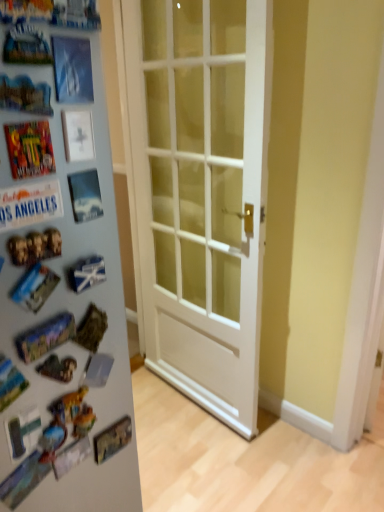
Describe the element at coordinates (200, 192) in the screenshot. I see `white glossy door at center` at that location.

Measure the distance between shiny metallic comic book at left and camera.

They are 58.01 centimeters apart.

This screenshot has width=384, height=512. Identify the location of white glossy refrigerator at left. (61, 278).

Image resolution: width=384 pixels, height=512 pixels. I want to click on white glossy door at center, so click(200, 192).

Is the surface of shiny metallic comic book at left in direct contact with white glossy refrigerator at left?

shiny metallic comic book at left and white glossy refrigerator at left are clearly separated.

In the image, is shiny metallic comic book at left positioned in front of or behind white glossy refrigerator at left?

Clearly, shiny metallic comic book at left is in front of white glossy refrigerator at left.

Consider the image. From a real-world perspective, is shiny metallic comic book at left over white glossy refrigerator at left?

Yes, from a real-world perspective, shiny metallic comic book at left is over white glossy refrigerator at left

Is point (30, 134) closer or farther from the camera than point (58, 399)?

Point (30, 134) is closer to the camera than point (58, 399).

Which point is more distant from viewer, (45, 156) or (266, 4)?

The point (266, 4) is more distant.

Is shiny metallic comic book at left directly adjacent to white glossy door at center?

No, shiny metallic comic book at left is not beside white glossy door at center.

From a real-world perspective, which is physically above, shiny metallic comic book at left or white glossy door at center?

In real-world perspective, shiny metallic comic book at left is above.

Is shiny metallic comic book at left positioned beyond the bounds of white glossy door at center?

Yes.

From the image's perspective, which is above, white glossy door at center or shiny metallic comic book at left?

From the image's view, shiny metallic comic book at left is above.

Is shiny metallic comic book at left surrounded by white glossy door at center?

That's incorrect, shiny metallic comic book at left is not inside white glossy door at center.

From the picture: From a real-world perspective, who is located lower, white glossy door at center or shiny metallic comic book at left?

From a 3D spatial view, white glossy door at center is below.

Locate an element on the screen. This screenshot has width=384, height=512. comic book above the white glossy door at center (from a real-world perspective) is located at coordinates (30, 149).

Does white glossy door at center come behind white glossy refrigerator at left?

Yes, white glossy door at center is further from the viewer.

Which of these two, white glossy door at center or white glossy refrigerator at left, stands shorter?

white glossy door at center.

Identify the location of door below the white glossy refrigerator at left (from a real-world perspective). (200, 192).

Between point (180, 21) and point (16, 262), which one is positioned behind?

The point (180, 21) is farther from the camera.

From a real-world perspective, between white glossy refrigerator at left and shiny metallic comic book at left, who is vertically higher?

shiny metallic comic book at left.

Based on the photo, is white glossy refrigerator at left to the right of shiny metallic comic book at left from the viewer's perspective?

No, white glossy refrigerator at left is not to the right of shiny metallic comic book at left.

From the image's perspective, would you say white glossy refrigerator at left is shown under shiny metallic comic book at left?

Correct, white glossy refrigerator at left appears lower than shiny metallic comic book at left in the image.

Can you confirm if white glossy refrigerator at left is shorter than shiny metallic comic book at left?

In fact, white glossy refrigerator at left may be taller than shiny metallic comic book at left.

Can you confirm if white glossy refrigerator at left is bigger than white glossy door at center?

Correct, white glossy refrigerator at left is larger in size than white glossy door at center.

Based on the photo, considering the relative sizes of white glossy refrigerator at left and white glossy door at center in the image provided, is white glossy refrigerator at left shorter than white glossy door at center?

In fact, white glossy refrigerator at left may be taller than white glossy door at center.

Can you see white glossy refrigerator at left touching white glossy door at center?

No, white glossy refrigerator at left is not in contact with white glossy door at center.

Is white glossy refrigerator at left positioned behind white glossy door at center?

No, white glossy refrigerator at left is closer to the camera.

At what (x,y) coordinates should I click in order to perform the action: click on comic book located above the white glossy refrigerator at left (from a real-world perspective). Please return your answer as a coordinate pair (x, y). The height and width of the screenshot is (512, 384). Looking at the image, I should click on (30, 149).

Locate an element on the screen. This screenshot has width=384, height=512. door that appears behind the shiny metallic comic book at left is located at coordinates (200, 192).

From the image, which object appears to be farther from white glossy refrigerator at left, white glossy door at center or shiny metallic comic book at left?

white glossy door at center is further to white glossy refrigerator at left.

When comparing their distances from white glossy door at center, does white glossy refrigerator at left or shiny metallic comic book at left seem further?

shiny metallic comic book at left is further to white glossy door at center.

From the image, which object appears to be farther from white glossy door at center, shiny metallic comic book at left or white glossy refrigerator at left?

Based on the image, shiny metallic comic book at left appears to be further to white glossy door at center.

Looking at the image, which one is located further to shiny metallic comic book at left, white glossy refrigerator at left or white glossy door at center?

white glossy door at center is positioned further to the anchor shiny metallic comic book at left.

Looking at the image, which one is located further to white glossy refrigerator at left, shiny metallic comic book at left or white glossy door at center?

white glossy door at center lies further to white glossy refrigerator at left than the other object.

Estimate the real-world distances between objects in this image. Which object is closer to shiny metallic comic book at left, white glossy door at center or white glossy refrigerator at left?

white glossy refrigerator at left is closer to shiny metallic comic book at left.

Identify the location of comic book situated between white glossy refrigerator at left and white glossy door at center from left to right. (30, 149).